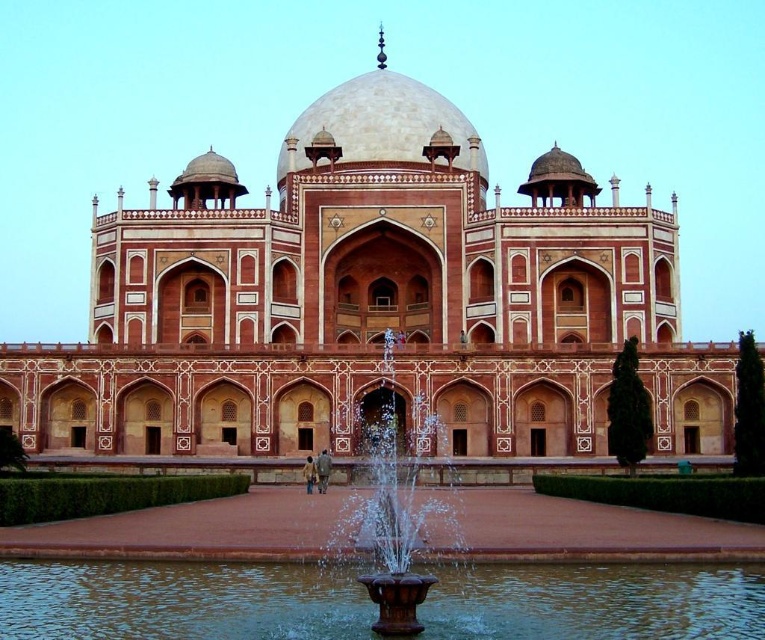
Question: Among these points, which one is farthest from the camera?

Choices:
 (A) (140, 419)
 (B) (163, 564)
 (C) (412, 490)

Answer: (A)

Question: Can you confirm if reddish-brown stone palace at center is thinner than brown water at center?

Choices:
 (A) yes
 (B) no

Answer: (B)

Question: Which is farther from the brown stone fountain at center?

Choices:
 (A) reddish-brown stone palace at center
 (B) brown water at center

Answer: (A)

Question: Is brown water at center to the right of brown stone fountain at center from the viewer's perspective?

Choices:
 (A) no
 (B) yes

Answer: (B)

Question: Estimate the real-world distances between objects in this image. Which object is farther from the brown water at center?

Choices:
 (A) brown stone fountain at center
 (B) reddish-brown stone palace at center

Answer: (B)

Question: Does brown water at center have a greater width compared to brown stone fountain at center?

Choices:
 (A) no
 (B) yes

Answer: (B)